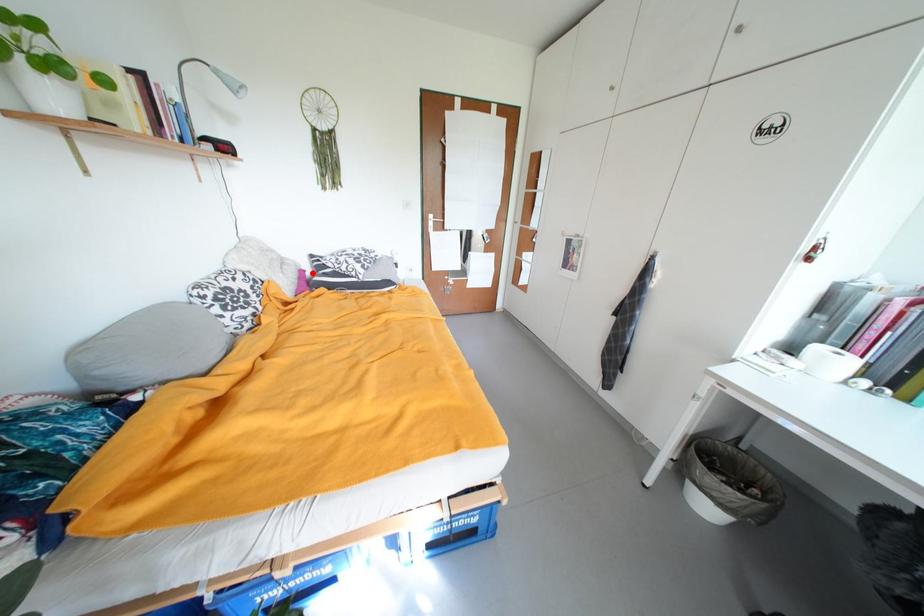
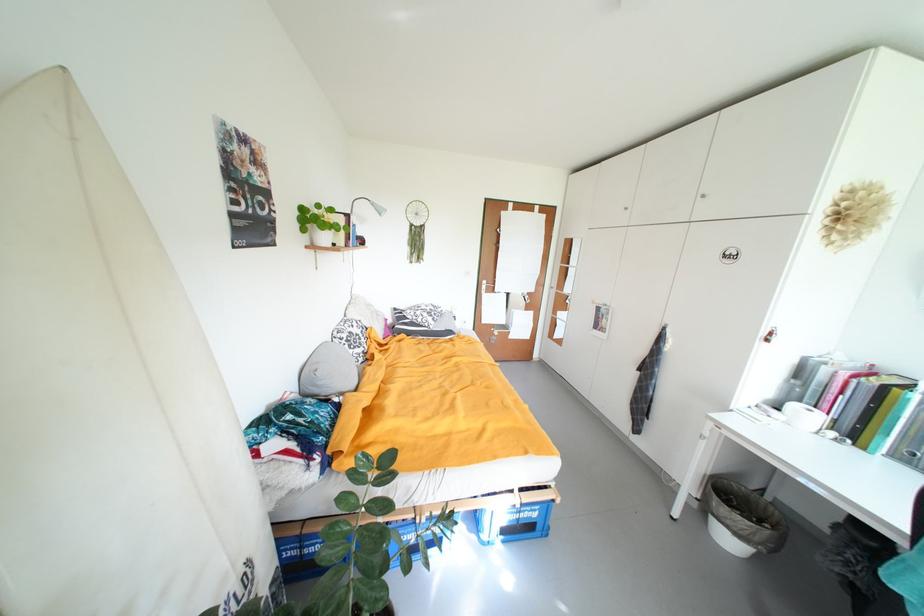
Question: I am providing you with two images of the same scene from different viewpoints. Image1 has a red point marked. In image2, the corresponding 3D location appears at what relative position? Reply with the corresponding letter.

Choices:
 (A) Closer
 (B) Farther

Answer: (B)